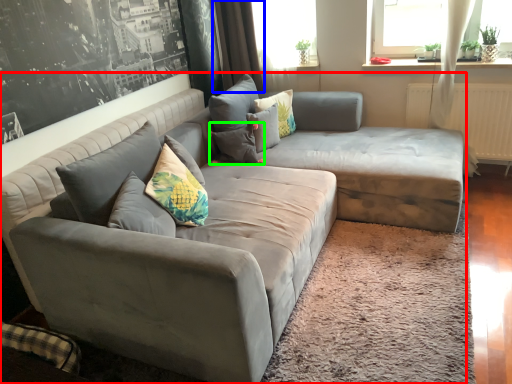
Question: Which is nearer to the studio couch (highlighted by a red box)? curtain (highlighted by a blue box) or pillow (highlighted by a green box).

Choices:
 (A) curtain
 (B) pillow

Answer: (B)